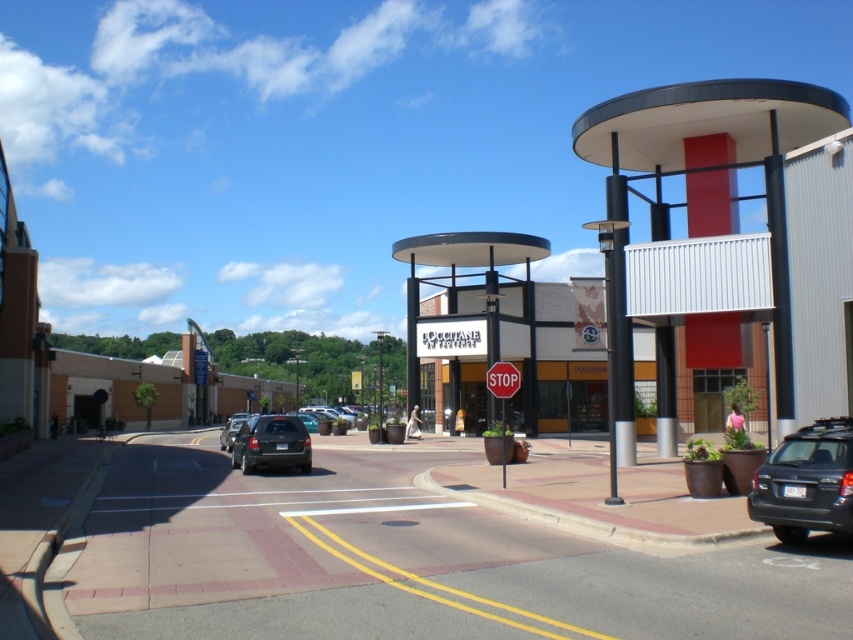
You are a delivery driver who needs to know which object is bigger between the white matte signboard at center and the red matte stop sign at center. Can you tell me which one is bigger?

The white matte signboard at center is larger in size than the red matte stop sign at center.

You are a delivery person needing to place a new sign between the white matte signboard at center and the red matte stop sign at center. The sign requires a minimum of 2 meters of space on both sides. Can you fit it between them?

The white matte signboard at center and red matte stop sign at center are 23.47 meters apart, so yes, the new sign can be placed between them with the required 2 meters of space on both sides since 23.47 meters is more than enough to accommodate the sign and the spacing.